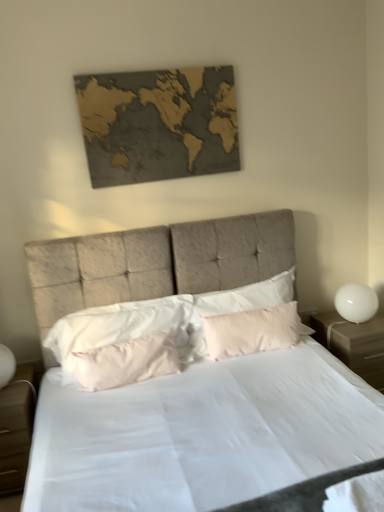
Question: Would you say light brown wood nightstand at lower left, which appears as the 2th nightstand when viewed from the right, is outside white glossy sphere at right?

Choices:
 (A) yes
 (B) no

Answer: (A)

Question: Does light brown wood nightstand at lower left, which appears as the 2th nightstand when viewed from the right, turn towards white glossy sphere at right?

Choices:
 (A) no
 (B) yes

Answer: (A)

Question: Does light brown wood nightstand at lower left, marked as the first nightstand in a left-to-right arrangement, contain white glossy sphere at right?

Choices:
 (A) no
 (B) yes

Answer: (A)

Question: Is light brown wood nightstand at lower left, which appears as the 2th nightstand when viewed from the right, not close to white glossy sphere at right?

Choices:
 (A) no
 (B) yes

Answer: (B)

Question: From a real-world perspective, is light brown wood nightstand at lower left, marked as the first nightstand in a left-to-right arrangement, over white glossy sphere at right?

Choices:
 (A) no
 (B) yes

Answer: (A)

Question: From the image's perspective, would you say light brown wood nightstand at lower left, marked as the first nightstand in a left-to-right arrangement, is shown under white glossy sphere at right?

Choices:
 (A) yes
 (B) no

Answer: (A)

Question: Does pink fabric pillow at center, positioned as the 1th pillow in right-to-left order, come in front of light brown wood nightstand at lower left, which appears as the 2th nightstand when viewed from the right?

Choices:
 (A) yes
 (B) no

Answer: (B)

Question: Is pink fabric pillow at center, the 3th pillow when ordered from left to right, oriented away from light brown wood nightstand at lower left, marked as the first nightstand in a left-to-right arrangement?

Choices:
 (A) yes
 (B) no

Answer: (B)

Question: Would you consider pink fabric pillow at center, positioned as the 1th pillow in right-to-left order, to be distant from light brown wood nightstand at lower left, which appears as the 2th nightstand when viewed from the right?

Choices:
 (A) no
 (B) yes

Answer: (B)

Question: Is pink fabric pillow at center, positioned as the 1th pillow in right-to-left order, smaller than light brown wood nightstand at lower left, which appears as the 2th nightstand when viewed from the right?

Choices:
 (A) no
 (B) yes

Answer: (B)

Question: Could light brown wood nightstand at lower left, marked as the first nightstand in a left-to-right arrangement, be considered to be inside pink fabric pillow at center, the 3th pillow when ordered from left to right?

Choices:
 (A) yes
 (B) no

Answer: (B)

Question: From a real-world perspective, is pink fabric pillow at center, positioned as the 1th pillow in right-to-left order, physically above light brown wood nightstand at lower left, which appears as the 2th nightstand when viewed from the right?

Choices:
 (A) no
 (B) yes

Answer: (B)

Question: From the image's perspective, is matte beige bed at center on light brown wood nightstand at lower left, which appears as the 2th nightstand when viewed from the right?

Choices:
 (A) no
 (B) yes

Answer: (B)